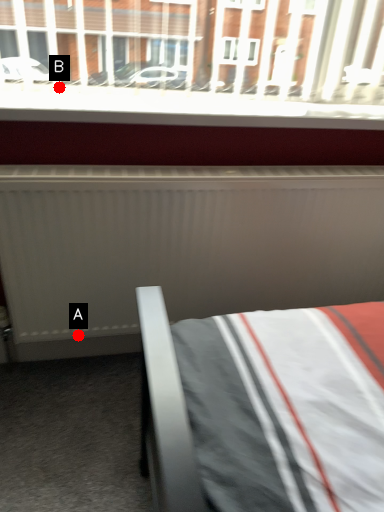
Question: Two points are circled on the image, labeled by A and B beside each circle. Which point is farther to the camera?

Choices:
 (A) A is further
 (B) B is further

Answer: (A)